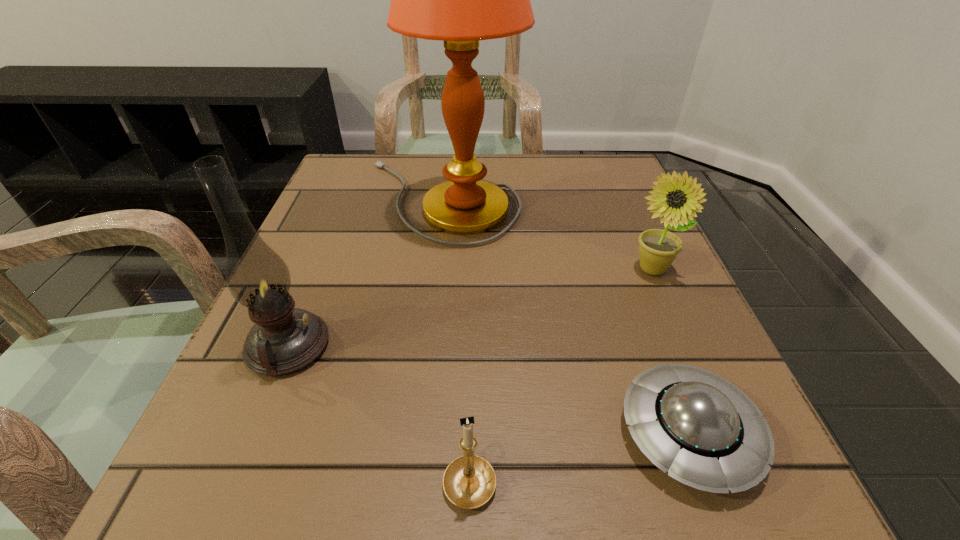
The width and height of the screenshot is (960, 540). What are the coordinates of `vacant space located on the handle side of the fourth tallest object` in the screenshot? It's located at (473, 253).

You are a GUI agent. You are given a task and a screenshot of the screen. Output one action in this format:
    pyautogui.click(x=<x>, y=<y>)
    Task: Click on the vacant space located on the handle side of the fourth tallest object
    
    Given the screenshot: What is the action you would take?
    pyautogui.click(x=472, y=355)

You are a GUI agent. You are given a task and a screenshot of the screen. Output one action in this format:
    pyautogui.click(x=<x>, y=<y>)
    Task: Click on the blank space located 0.290m on the handle side of the fourth tallest object
    This screenshot has width=960, height=540.
    Given the screenshot: What is the action you would take?
    pyautogui.click(x=473, y=286)

I want to click on vacant region located on the left of the saucer, so click(x=337, y=433).

Find the location of a particular element. object positioned at the far edge is located at coordinates (460, 0).

This screenshot has height=540, width=960. What are the coordinates of `candle holder positioned at the near edge` in the screenshot? It's located at pyautogui.click(x=469, y=481).

You are a GUI agent. You are given a task and a screenshot of the screen. Output one action in this format:
    pyautogui.click(x=<x>, y=<y>)
    Task: Click on the saucer located in the near edge section of the desktop
    
    Given the screenshot: What is the action you would take?
    pyautogui.click(x=704, y=431)

You are a GUI agent. You are given a task and a screenshot of the screen. Output one action in this format:
    pyautogui.click(x=<x>, y=<y>)
    Task: Click on the lamp that is at the left edge
    The width and height of the screenshot is (960, 540).
    Given the screenshot: What is the action you would take?
    pyautogui.click(x=460, y=0)

The width and height of the screenshot is (960, 540). Find the location of `oil lamp that is at the left edge`. oil lamp that is at the left edge is located at coordinates (284, 339).

Find the location of a particular element. sunflower present at the right edge is located at coordinates (658, 248).